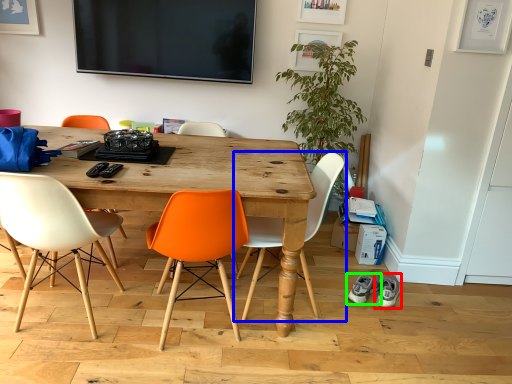
Question: Which object is positioned closest to footwear (highlighted by a red box)? Select from chair (highlighted by a blue box) and footwear (highlighted by a green box).

Choices:
 (A) chair
 (B) footwear

Answer: (B)